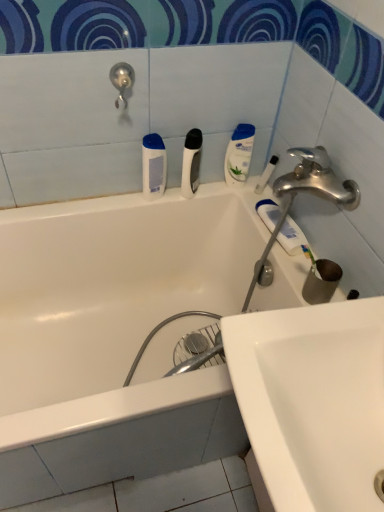
Question: Considering the relative sizes of white glossy bathtub at upper center and clear plastic toothbrush at upper right, marked as the fourth toiletry in a left-to-right arrangement, in the image provided, is white glossy bathtub at upper center shorter than clear plastic toothbrush at upper right, marked as the fourth toiletry in a left-to-right arrangement,?

Choices:
 (A) yes
 (B) no

Answer: (B)

Question: Is white glossy bathtub at upper center smaller than clear plastic toothbrush at upper right, acting as the first toiletry starting from the right?

Choices:
 (A) yes
 (B) no

Answer: (B)

Question: Is white glossy bathtub at upper center further to camera compared to clear plastic toothbrush at upper right, acting as the first toiletry starting from the right?

Choices:
 (A) yes
 (B) no

Answer: (B)

Question: Is white glossy bathtub at upper center in contact with clear plastic toothbrush at upper right, acting as the first toiletry starting from the right?

Choices:
 (A) yes
 (B) no

Answer: (B)

Question: Is white glossy bathtub at upper center at the left side of clear plastic toothbrush at upper right, marked as the fourth toiletry in a left-to-right arrangement?

Choices:
 (A) yes
 (B) no

Answer: (A)

Question: Is white glossy bathtub at upper center turned away from clear plastic toothbrush at upper right, acting as the first toiletry starting from the right?

Choices:
 (A) yes
 (B) no

Answer: (B)

Question: From the image's perspective, is white matte toothpaste at upper right beneath white glossy lotion at upper right, which is the second toiletry from right to left?

Choices:
 (A) no
 (B) yes

Answer: (B)

Question: Considering the relative positions of white matte toothpaste at upper right and white glossy lotion at upper right, the third toiletry from the left, in the image provided, is white matte toothpaste at upper right in front of white glossy lotion at upper right, the third toiletry from the left,?

Choices:
 (A) no
 (B) yes

Answer: (B)

Question: Is white matte toothpaste at upper right located outside white glossy lotion at upper right, the third toiletry from the left?

Choices:
 (A) no
 (B) yes

Answer: (B)

Question: Can you confirm if white matte toothpaste at upper right is positioned to the right of white glossy lotion at upper right, the third toiletry from the left?

Choices:
 (A) yes
 (B) no

Answer: (A)

Question: Can you confirm if white matte toothpaste at upper right is thinner than white glossy lotion at upper right, the third toiletry from the left?

Choices:
 (A) yes
 (B) no

Answer: (B)

Question: Is white matte toothpaste at upper right far from white glossy lotion at upper right, which is the second toiletry from right to left?

Choices:
 (A) no
 (B) yes

Answer: (A)

Question: From a real-world perspective, is white glossy lotion at upper right, which is the second toiletry from right to left, over white matte razor at center, the 2th toiletry when ordered from left to right?

Choices:
 (A) yes
 (B) no

Answer: (B)